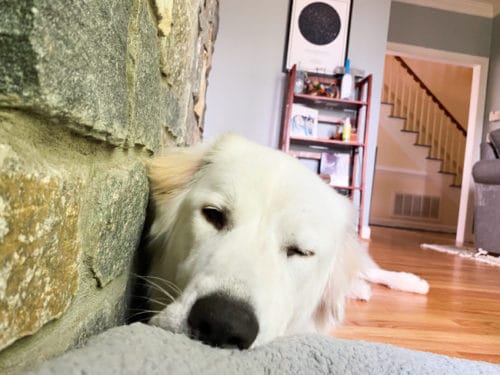
Find the location of a particular element. Image resolution: width=500 pixels, height=375 pixels. brick wall is located at coordinates (104, 186).